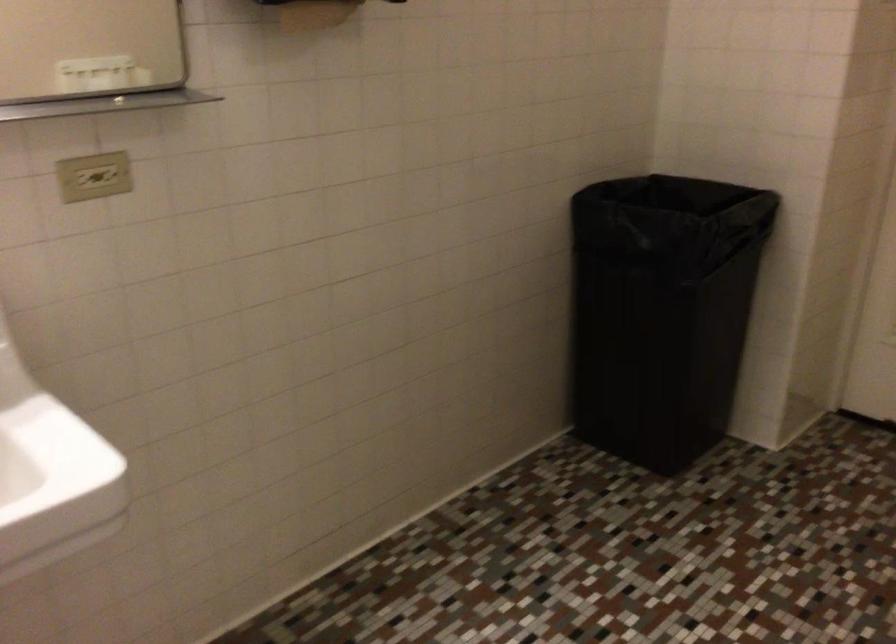
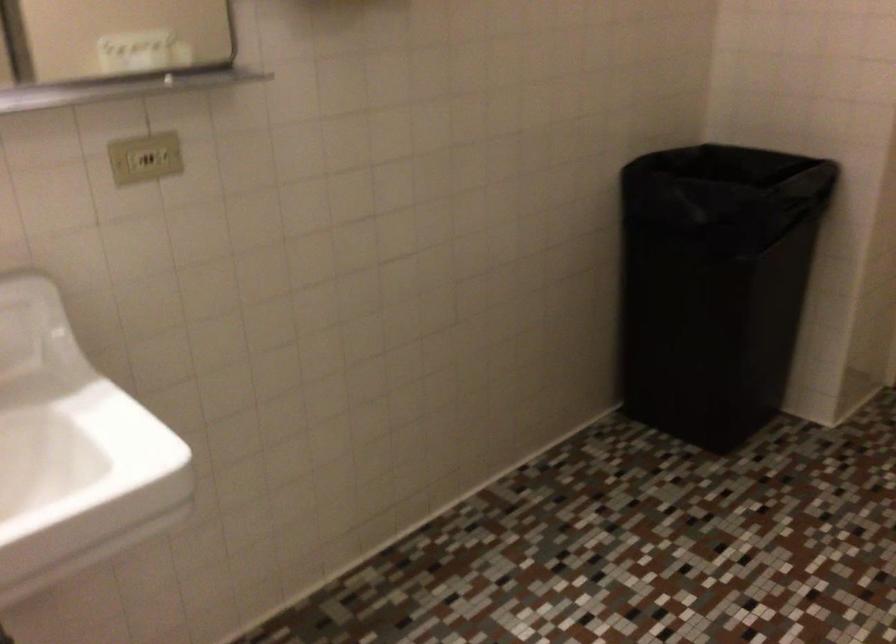
Question: Based on the continuous images, in which direction is the camera rotating? Reply with the corresponding letter.

Choices:
 (A) Left
 (B) Right
 (C) Up
 (D) Down

Answer: (A)